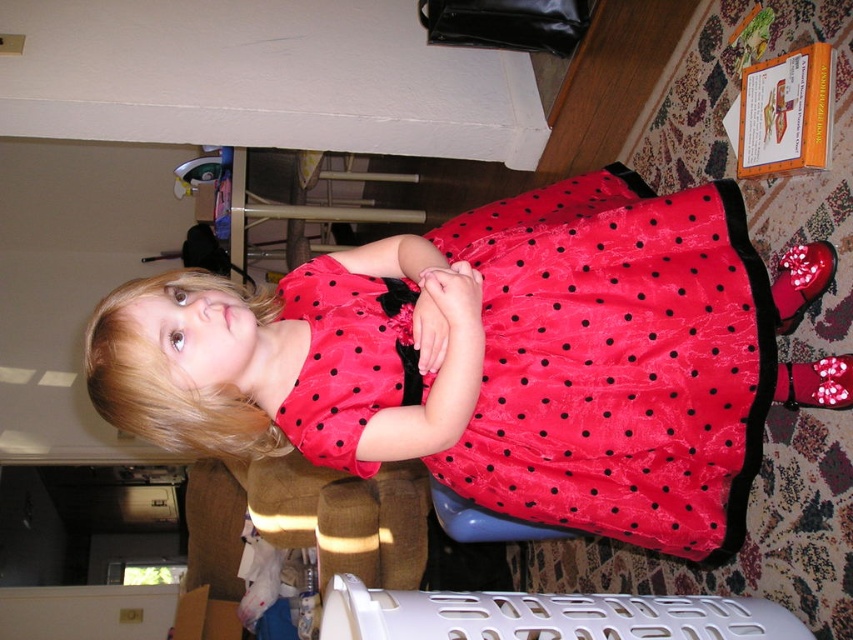
You are a fashion designer who needs to store the red satin dress at center in the white plastic laundry basket at lower center. Based on the image, can the dress fit inside the basket?

The red satin dress at center might be wider than white plastic laundry basket at lower center, so it may not fit properly inside the basket.

You are a photographer setting up for a photoshoot in this living room. You need to position a tripod so that both the red satin dress at center and the white plastic laundry basket at lower center are visible in the frame. Considering their heights, which object will appear larger in the photo?

The red satin dress at center will appear larger in the photo because it is much taller than the white plastic laundry basket at lower center.

In the scene shown: You are standing in a living room and want to place a 1.2 meter long sofa. There is a point at coordinates point (640, 253) that you must avoid. Can you fit the sofa in this space?

The distance from the viewer to point (640, 253) is 1.50 meters. Since the sofa is 1.2 meters long, it can be placed in the space as long as it does not extend beyond the 1.50 meter distance from the viewer to the point. However, the exact placement depends on the room layout and other obstacles not specified here.